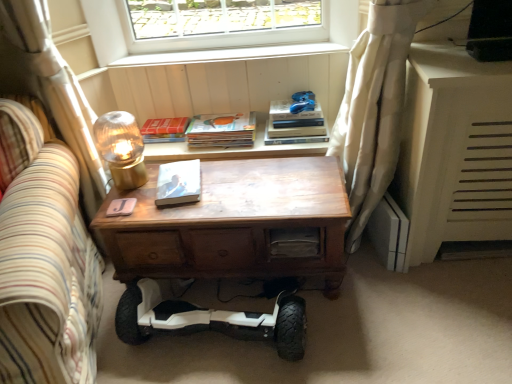
Where is `vacant area that lies in front of matte white book at center, placed as the first paperback book when sorted from bottom to top`? vacant area that lies in front of matte white book at center, placed as the first paperback book when sorted from bottom to top is located at coordinates (176, 211).